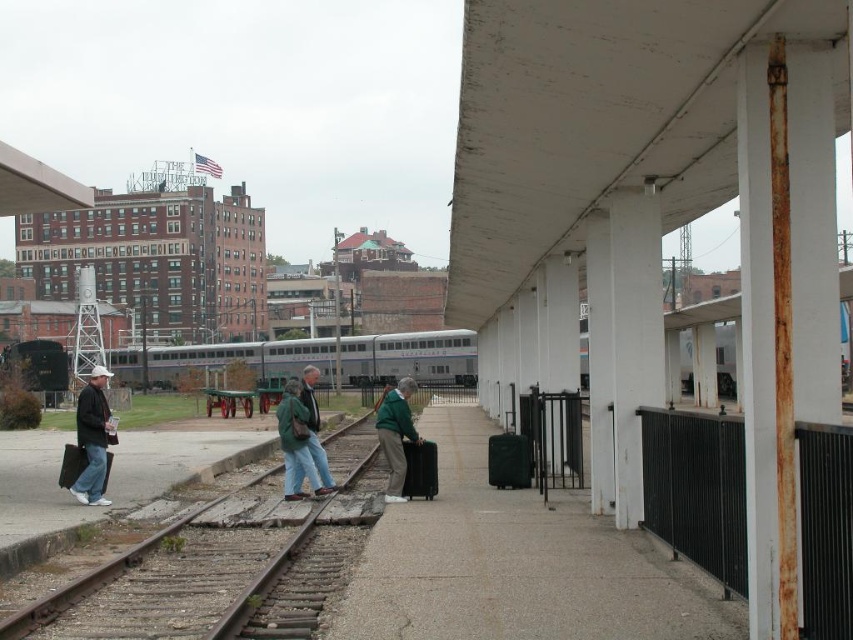
You are standing at the covered platform on the right side of the train station. Looking towards the tracks, you notice a specific point marked at coordinates point (102, 572). What object is located at that point?

The point (102, 572) marks the rusty metal train track at lower left.

You are standing at the train station and want to reach the green suitcase placed on the ground near the tracks. The green suitcase is located at point (416, 484). If your walking speed is 1.2 meters per second, how many seconds will it take you to reach the green suitcase?

The distance between you and the green suitcase at point (416, 484) is 13.62 meters. At a walking speed of 1.2 meters per second, it will take approximately 11.35 seconds to reach it.

You are a delivery person who needs to move a 6.5 meter long ladder from the black matte suitcase at center to the matte black suitcase at left. Can you fit the ladder between them without bending it?

The distance between the black matte suitcase at center and the matte black suitcase at left is 5.20 meters. Since the ladder is 6.5 meters long, it cannot fit between them without bending.